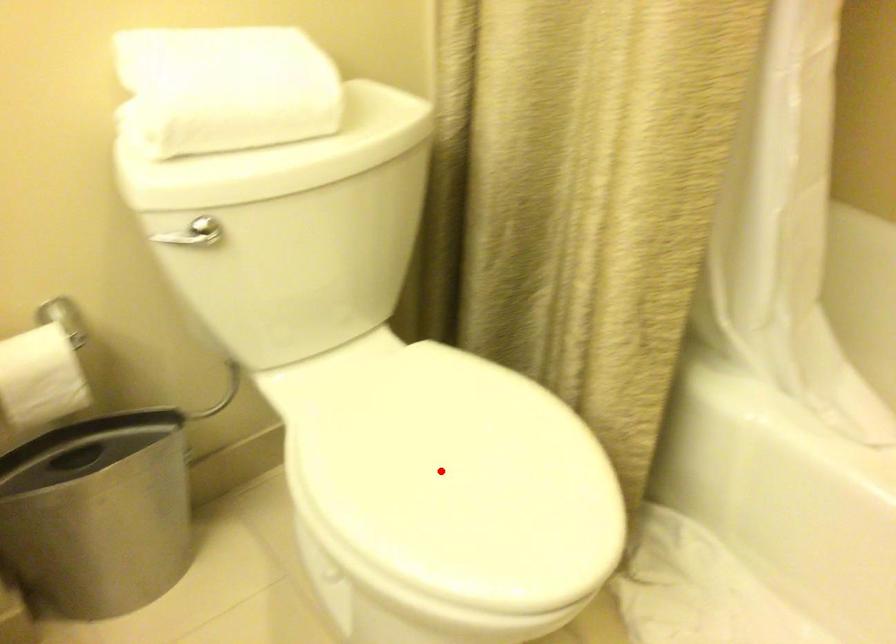
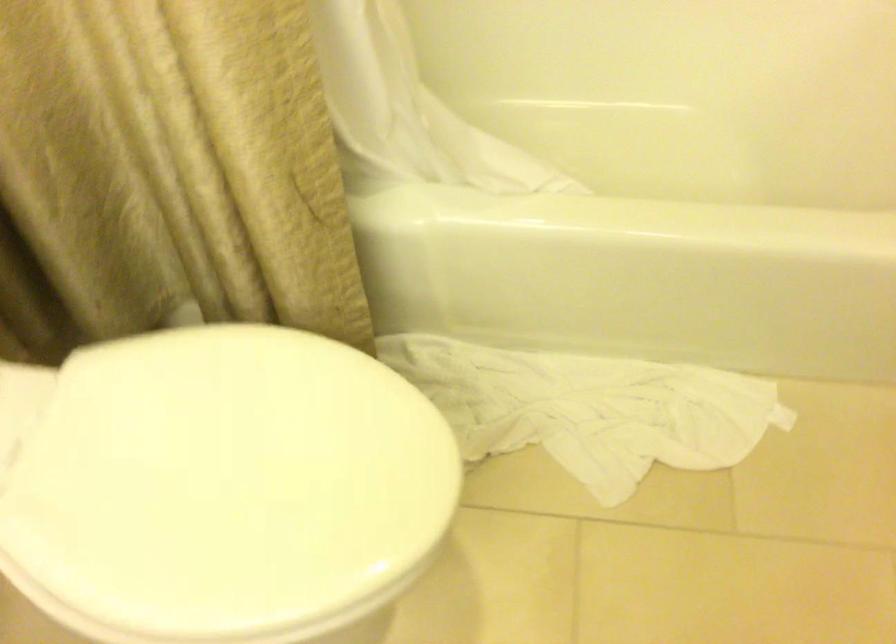
Find the pixel in the second image that matches the highlighted location in the first image.

(219, 484)